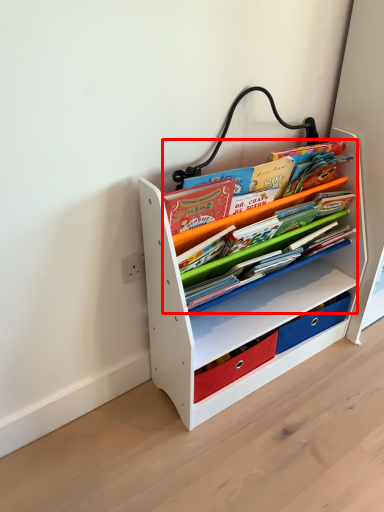
Question: From the image, what is the correct spatial relationship of book (annotated by the red box) in relation to shelf?

Choices:
 (A) left
 (B) right

Answer: (A)